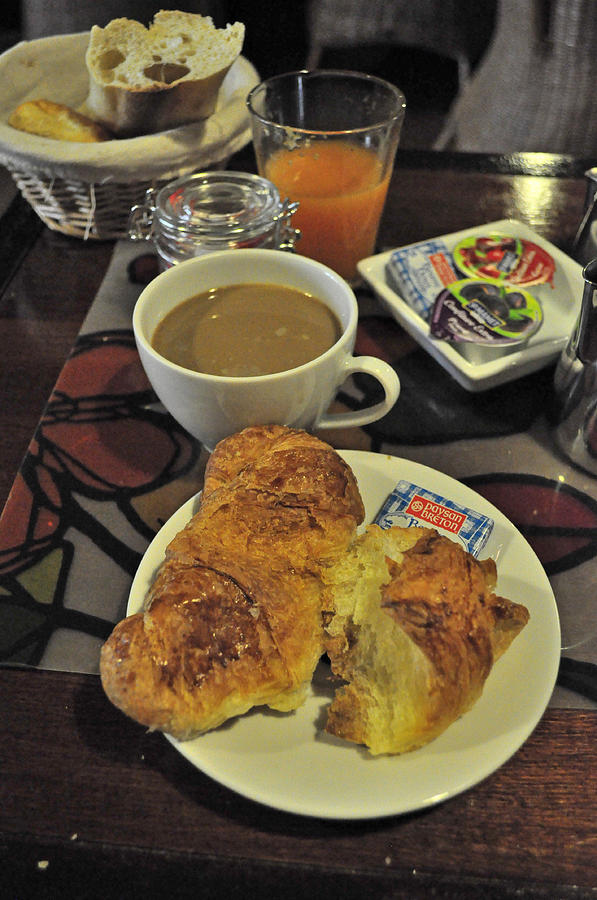
Where is `dark wooden surface or table`? This screenshot has height=900, width=597. dark wooden surface or table is located at coordinates (104, 814).